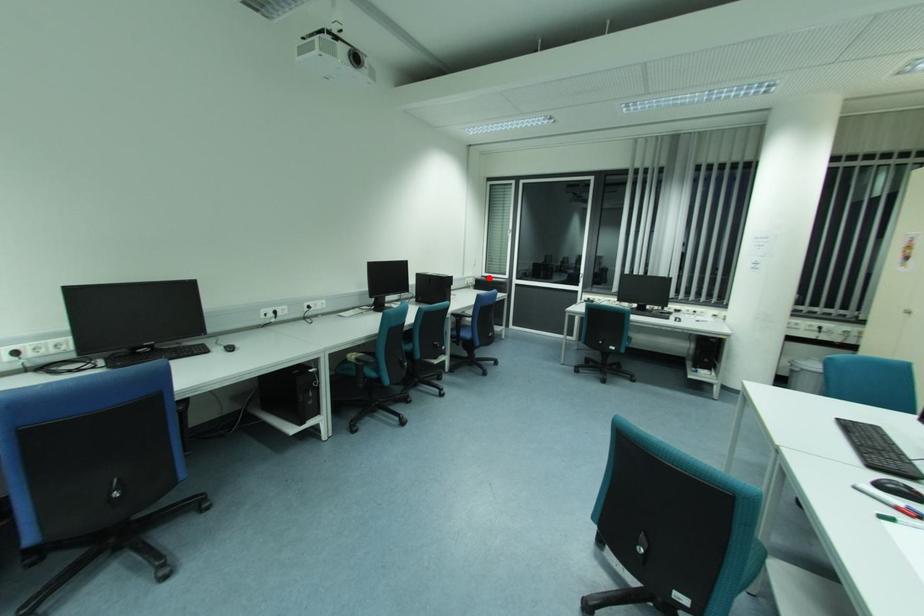
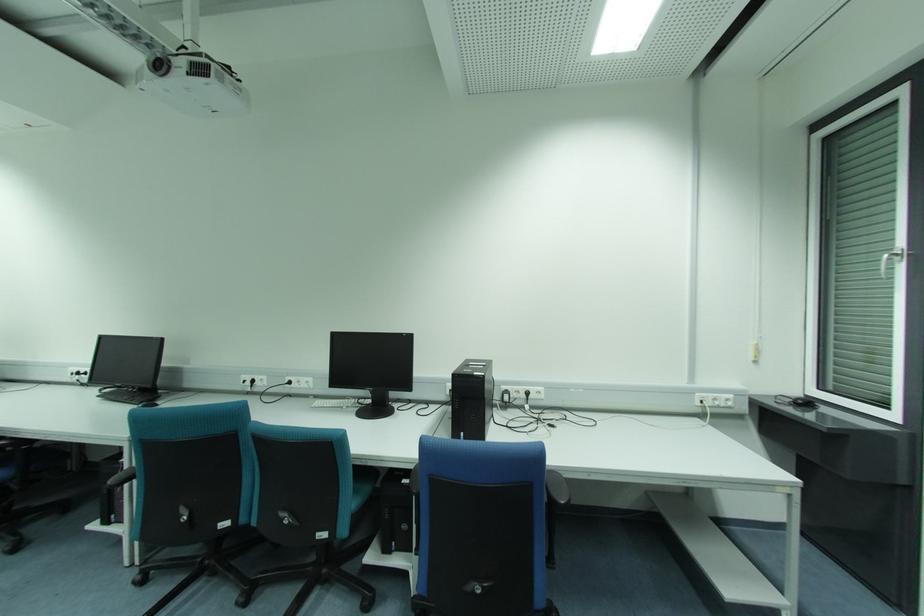
Question: I am providing you with two images of the same scene from different viewpoints. A red point is marked on the first image. At the location where the point appears in image 1, is it still visible in image 2?

Choices:
 (A) Yes
 (B) No

Answer: (A)